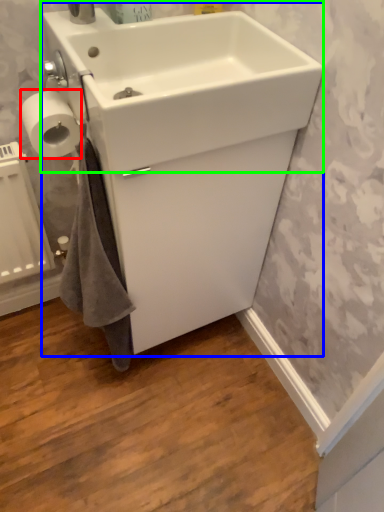
Question: Which object is the closest to the toilet paper (highlighted by a red box)? Choose among these: sink (highlighted by a blue box) or sink (highlighted by a green box).

Choices:
 (A) sink
 (B) sink

Answer: (B)